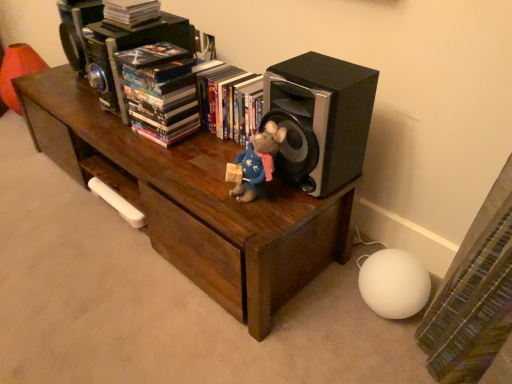
You are a GUI agent. You are given a task and a screenshot of the screen. Output one action in this format:
    pyautogui.click(x=<x>, y=<y>)
    Task: Click on the vacant area that lies in front of multicolored paperbacks at upper center, positioned as the second book in right-to-left order
    This screenshot has height=384, width=512.
    Given the screenshot: What is the action you would take?
    point(173,154)